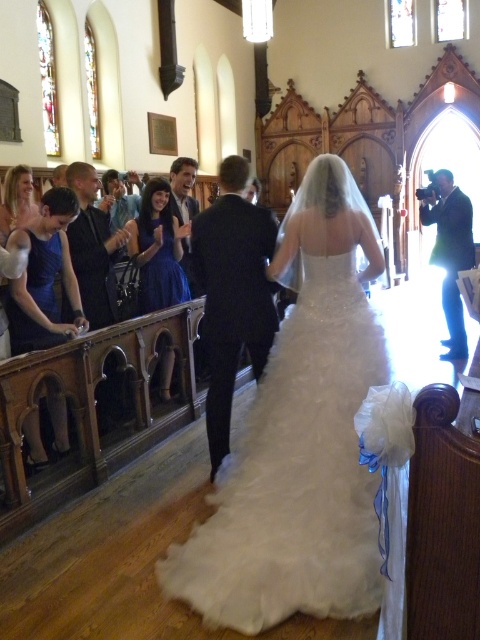
Who is lower down, dark suit at center or matte black suit at center?

Positioned lower is dark suit at center.

Can you confirm if dark suit at center is taller than matte black suit at center?

Correct, dark suit at center is much taller as matte black suit at center.

Which is in front, point (196, 227) or point (187, 156)?

Point (196, 227) is more forward.

Find the location of a particular element. dark suit at center is located at coordinates (232, 292).

Which of these two, matte black camera at right or satin blue dress at center, stands shorter?

Standing shorter between the two is satin blue dress at center.

Which is more to the left, matte black camera at right or satin blue dress at center?

From the viewer's perspective, satin blue dress at center appears more on the left side.

Which is behind, point (441, 208) or point (171, 278)?

Point (441, 208)

This screenshot has height=640, width=480. In order to click on matte black camera at right in this screenshot , I will do `click(450, 250)`.

Which is in front, point (104, 272) or point (451, 284)?

Point (104, 272)

Between dark gray suit at center and matte black camera at right, which one is positioned higher?

matte black camera at right

Between point (88, 220) and point (437, 236), which one is positioned in front?

Positioned in front is point (88, 220).

I want to click on dark gray suit at center, so click(x=93, y=248).